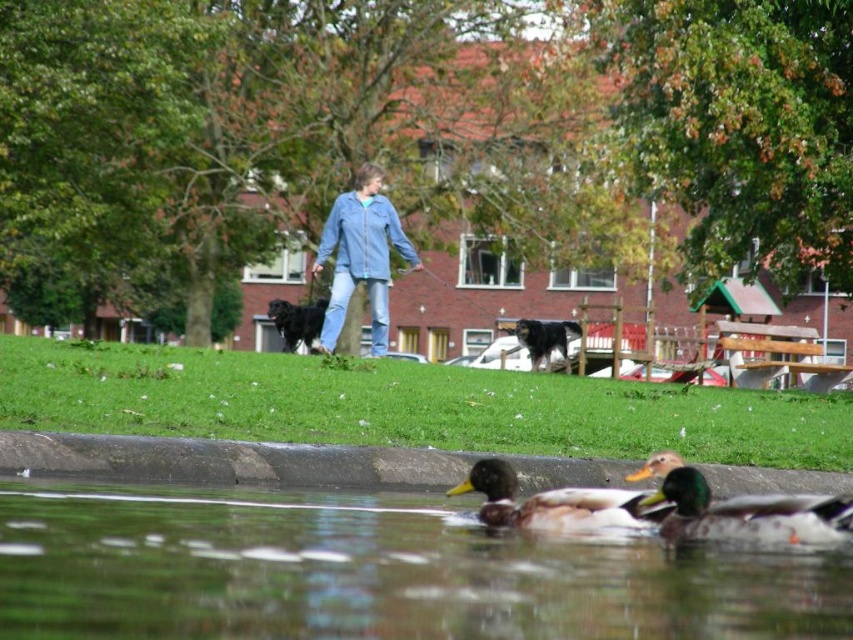
From the picture: Between brown feathered duck at lower center and black matte dog at center, which one is positioned higher?

black matte dog at center

Which of these two, brown feathered duck at lower center or black matte dog at center, stands taller?

black matte dog at center

What are the coordinates of `brown feathered duck at lower center` in the screenshot? It's located at (555, 502).

Is point (393, 214) closer to camera compared to point (546, 506)?

No, (393, 214) is behind (546, 506).

Who is more distant from viewer, [349,189] or [584,515]?

Point [349,189]

Where is `denim jacket at center`? denim jacket at center is located at coordinates (360, 257).

From the picture: Is greenish water at lower center bigger than green glossy duck at lower center?

Yes, greenish water at lower center is bigger than green glossy duck at lower center.

Looking at this image, is the position of greenish water at lower center more distant than that of green glossy duck at lower center?

No.

Who is more forward, (x=759, y=625) or (x=728, y=529)?

Point (x=759, y=625) is more forward.

Where is `greenish water at lower center`? Image resolution: width=853 pixels, height=640 pixels. greenish water at lower center is located at coordinates (376, 572).